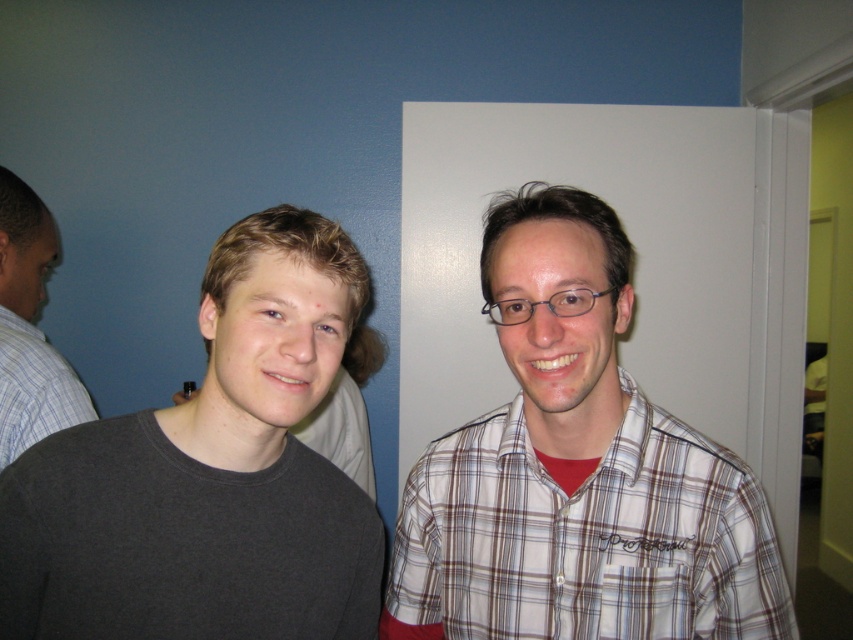
Question: Which object is the farthest from the dark gray matte shirt at left?

Choices:
 (A) gray cotton shirt at left
 (B) plaid shirt at right

Answer: (A)

Question: Can you confirm if dark gray matte shirt at left is bigger than gray cotton shirt at left?

Choices:
 (A) no
 (B) yes

Answer: (A)

Question: Which object is closer to the camera taking this photo?

Choices:
 (A) dark gray matte shirt at left
 (B) gray cotton shirt at left
 (C) plaid shirt at right

Answer: (A)

Question: Which object is positioned closest to the gray cotton shirt at left?

Choices:
 (A) plaid shirt at right
 (B) dark gray matte shirt at left

Answer: (B)

Question: Can you confirm if plaid shirt at right is wider than gray cotton shirt at left?

Choices:
 (A) no
 (B) yes

Answer: (B)

Question: Observing the image, what is the correct spatial positioning of dark gray matte shirt at left in reference to plaid shirt at right?

Choices:
 (A) above
 (B) below

Answer: (A)